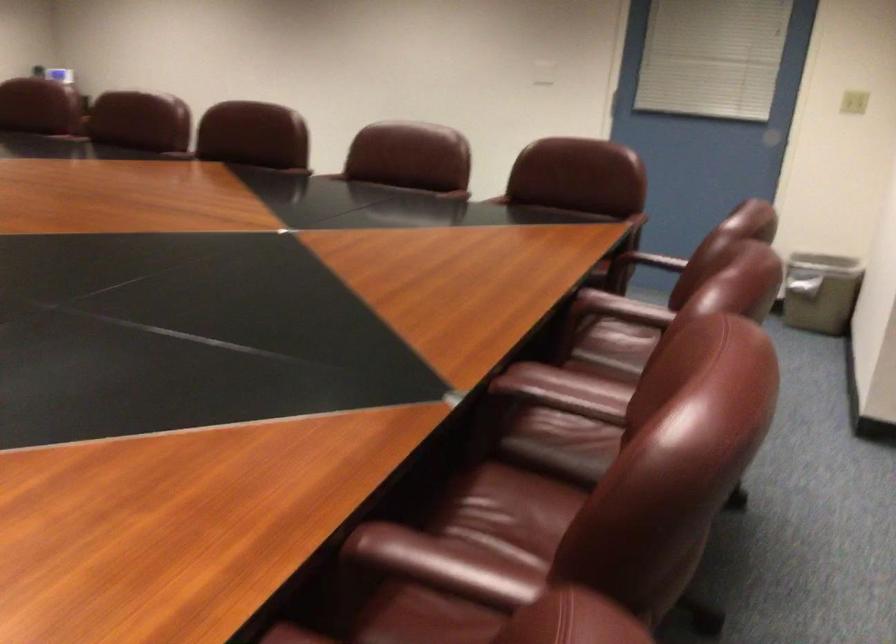
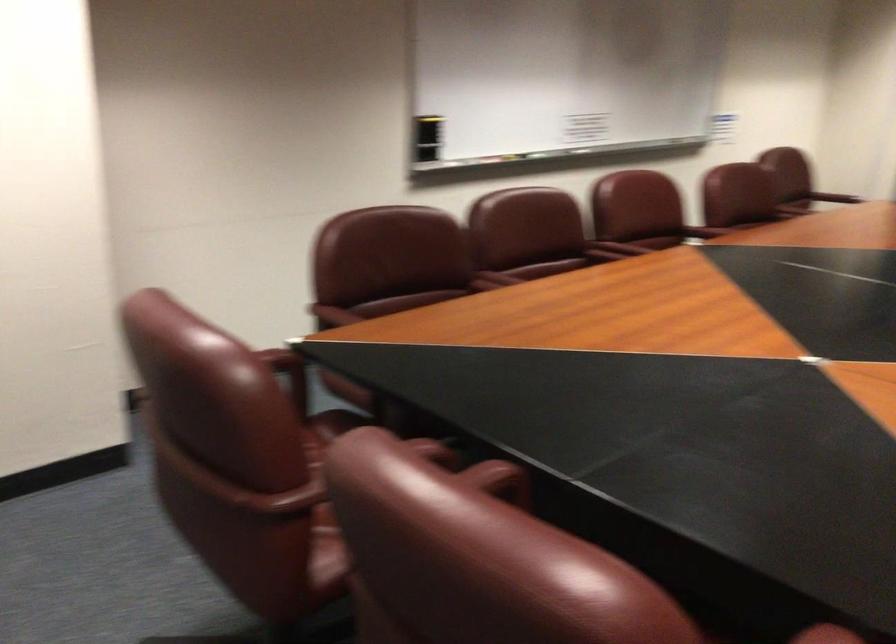
Where in the second image is the point corresponding to [462,556] from the first image?

(703, 232)